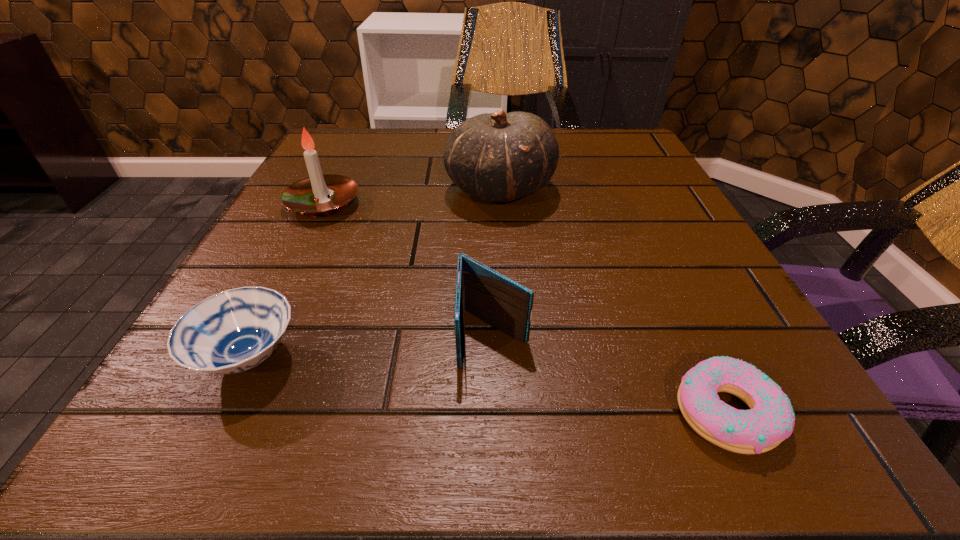
Find the location of a particular element. The image size is (960, 540). vacant position at the near edge of the desktop is located at coordinates (468, 411).

The width and height of the screenshot is (960, 540). In the image, there is a desktop. Find the location of `vacant space at the left edge`. vacant space at the left edge is located at coordinates (217, 381).

Where is `free spot at the right edge of the desktop`? The height and width of the screenshot is (540, 960). free spot at the right edge of the desktop is located at coordinates (630, 206).

The image size is (960, 540). Find the location of `vacant point at the far left corner`. vacant point at the far left corner is located at coordinates (341, 171).

Locate an element on the screen. The height and width of the screenshot is (540, 960). vacant region at the far right corner is located at coordinates (642, 154).

You are a GUI agent. You are given a task and a screenshot of the screen. Output one action in this format:
    pyautogui.click(x=<x>, y=<y>)
    Task: Click on the unoccupied area between the rightmost object and the fourth tallest object
    This screenshot has height=540, width=960.
    Given the screenshot: What is the action you would take?
    pyautogui.click(x=488, y=385)

Image resolution: width=960 pixels, height=540 pixels. What are the coordinates of `free space between the second shortest object and the third tallest object` in the screenshot? It's located at (371, 347).

Find the location of `vacant space that's between the wallet and the doughnut`. vacant space that's between the wallet and the doughnut is located at coordinates (610, 374).

Find the location of `vacant area that lies between the soup bowl and the gourd`. vacant area that lies between the soup bowl and the gourd is located at coordinates (374, 273).

Where is `unoccupied area between the fourth tallest object and the wallet`? The width and height of the screenshot is (960, 540). unoccupied area between the fourth tallest object and the wallet is located at coordinates (371, 347).